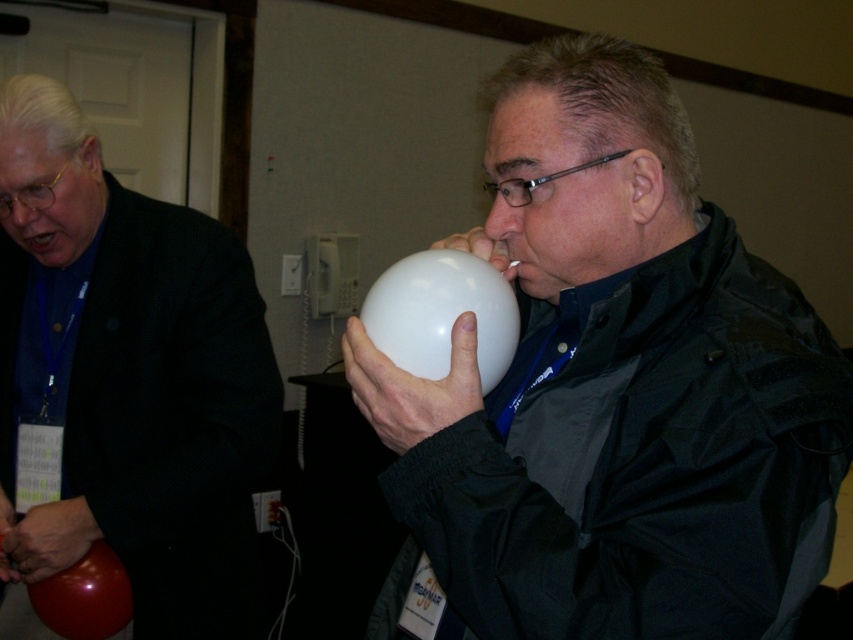
Question: Which of the following is the closest to the observer?

Choices:
 (A) matte white balloon at center
 (B) shiny red balloon at lower left

Answer: (A)

Question: Which of the following is the farthest from the observer?

Choices:
 (A) (149, 212)
 (B) (88, 588)
 (C) (724, 544)
 (D) (497, 289)

Answer: (A)

Question: Is matte black balloon at left further to camera compared to white rubber balloon at center?

Choices:
 (A) yes
 (B) no

Answer: (A)

Question: Estimate the real-world distances between objects in this image. Which object is closer to the matte black balloon at left?

Choices:
 (A) white rubber balloon at center
 (B) matte white balloon at center
 (C) white matte balloon at center

Answer: (A)

Question: Can you confirm if white matte balloon at center is positioned to the left of shiny red balloon at lower left?

Choices:
 (A) no
 (B) yes

Answer: (A)

Question: Can you confirm if white matte balloon at center is positioned below matte white balloon at center?

Choices:
 (A) yes
 (B) no

Answer: (A)